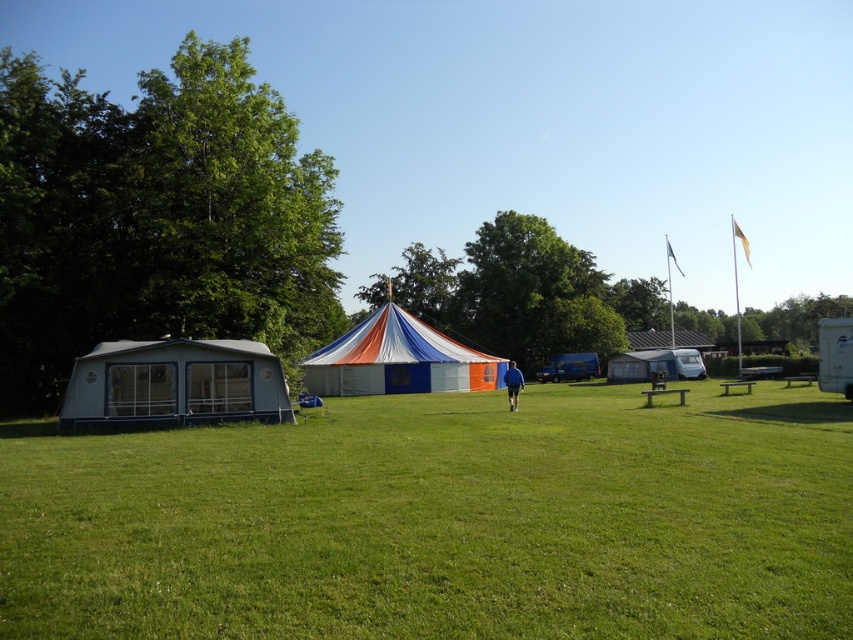
You are planning to set up a new tent in this campsite. The white canvas tent at center is already there. If you want to place your tent near the blue fabric person at center, which existing tent should you consider in terms of size when choosing your own tent?

The white canvas tent at center is bigger than the blue fabric person at center, so you should ensure your new tent is smaller than the white canvas tent at center to fit appropriately near the blue fabric person at center.

You are standing at the edge of the green grassy field at lower center and want to take a photo of the blue fabric person at center. Which direction should you move to get them in your frame?

The green grassy field at lower center is in front of the blue fabric person at center, so you should move backward to get the blue fabric person at center into your frame.

You are standing at the edge of the grassy field in the campsite and see the white canvas tent at center and the blue fabric person at center. If you want to reach both locations, which one is closer to you?

The white canvas tent at center and the blue fabric person at center are both at the center of the scene, so they are equidistant from your position at the edge of the grassy field. However, according to the description, the white canvas tent at center is 7.46 meters away from the blue fabric person at center. Therefore, you would need to determine your exact starting point relative to both to know which is closer.